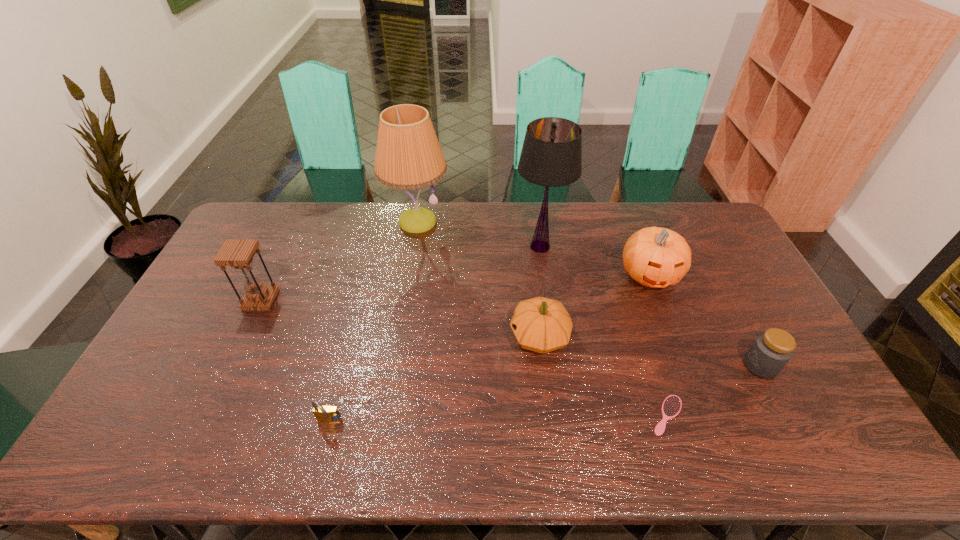
This screenshot has width=960, height=540. In the image, there is a desktop. Find the location of `vacant space at the left edge`. vacant space at the left edge is located at coordinates (218, 353).

The width and height of the screenshot is (960, 540). In order to click on free spot at the right edge of the desktop in this screenshot , I will do `click(745, 327)`.

The image size is (960, 540). In the image, there is a desktop. In order to click on free region at the far right corner in this screenshot , I will do `click(721, 227)`.

This screenshot has width=960, height=540. I want to click on vacant space that's between the lamp and the gourd, so click(x=478, y=279).

Where is `vacant area that lies between the lamp and the gourd`? The image size is (960, 540). vacant area that lies between the lamp and the gourd is located at coordinates (478, 279).

The width and height of the screenshot is (960, 540). I want to click on unoccupied area between the gourd and the lampshade, so click(x=540, y=292).

Locate an element on the screen. Image resolution: width=960 pixels, height=540 pixels. blank region between the jar and the lamp is located at coordinates (588, 294).

Image resolution: width=960 pixels, height=540 pixels. I want to click on empty space between the gourd and the rightmost object, so click(650, 351).

I want to click on vacant area that lies between the lampshade and the rightmost object, so [x=650, y=306].

Locate an element on the screen. This screenshot has width=960, height=540. vacant space in between the rightmost object and the lamp is located at coordinates (588, 294).